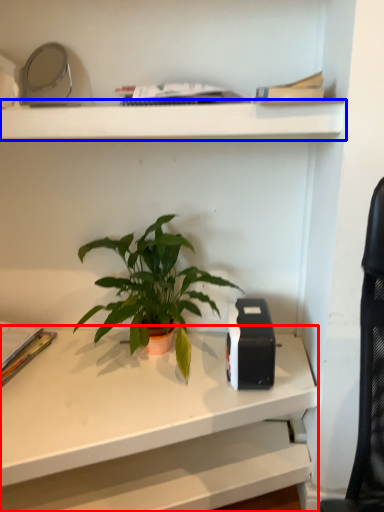
Question: Which of the following is the farthest to the observer, desk (highlighted by a red box) or shelf (highlighted by a blue box)?

Choices:
 (A) desk
 (B) shelf

Answer: (B)